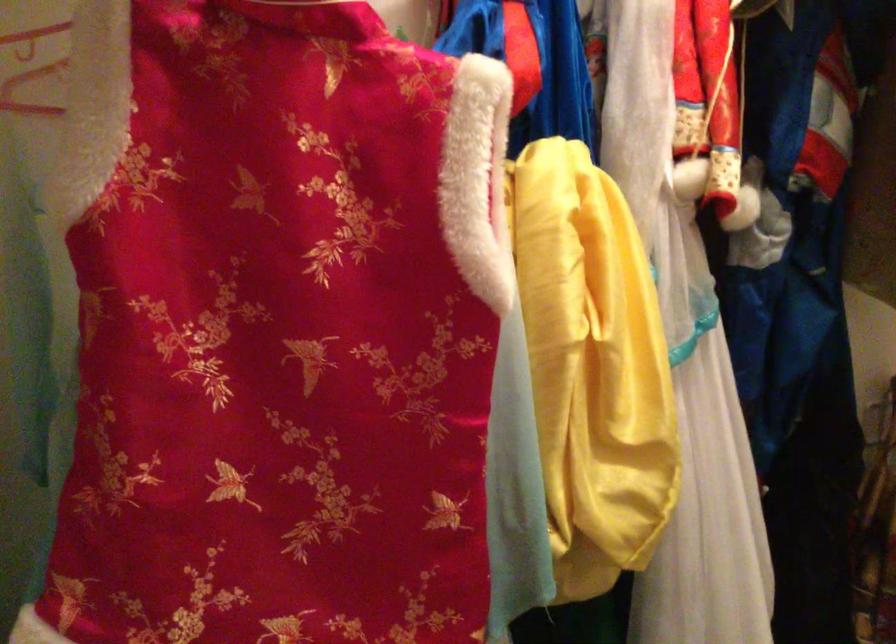
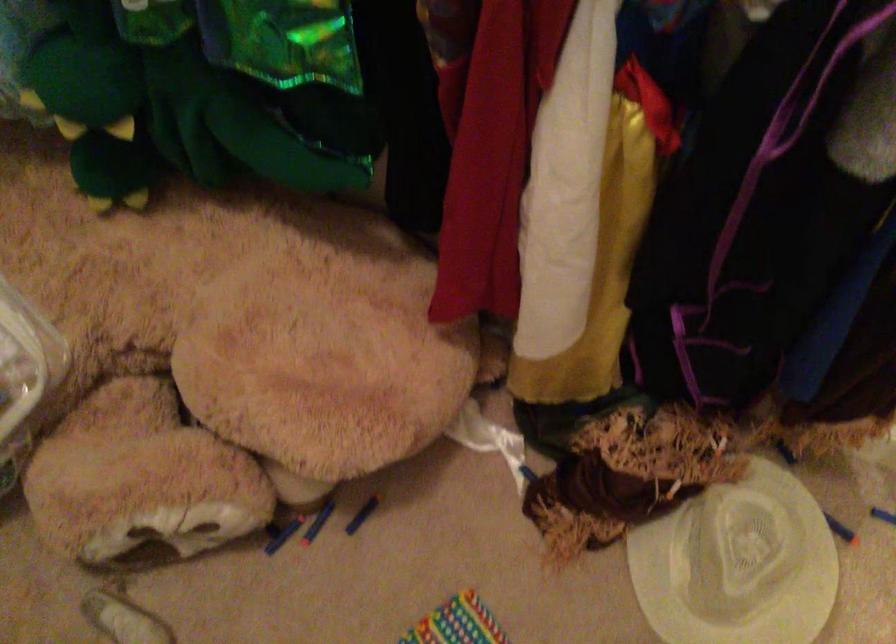
First-person continuous shooting, in which direction is the camera rotating?

The rotation direction of the camera is left-down.